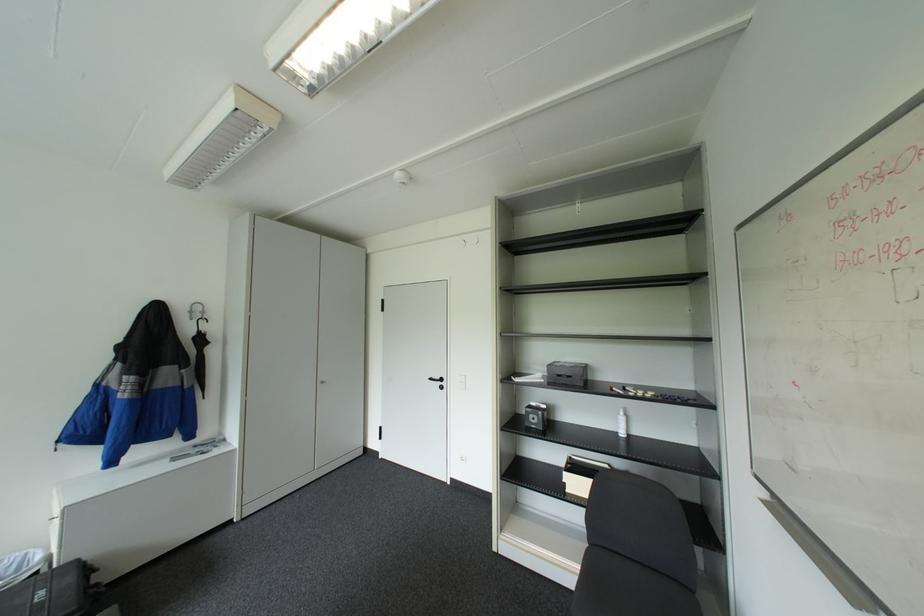
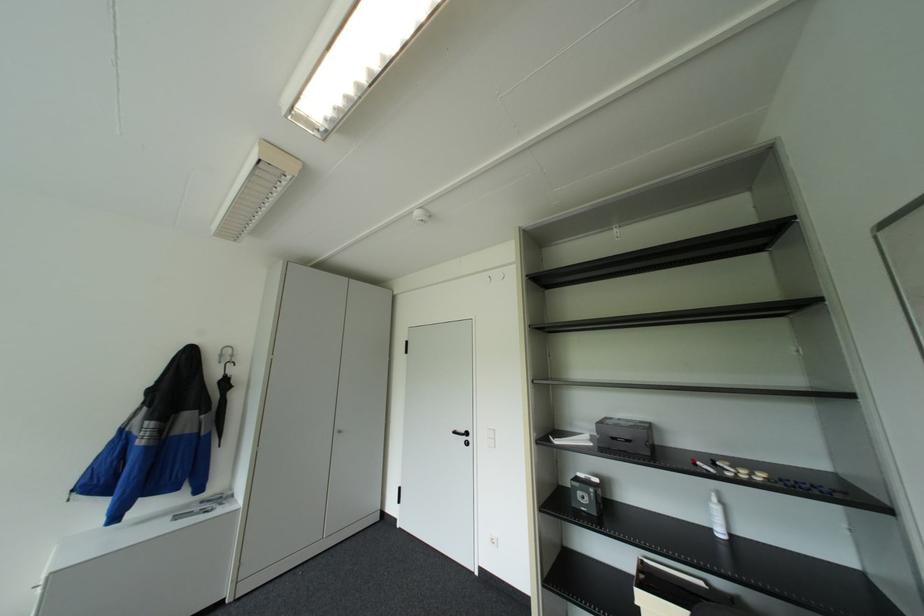
Locate, in the second image, the point that corresponds to pixel 439 378 in the first image.

(463, 431)